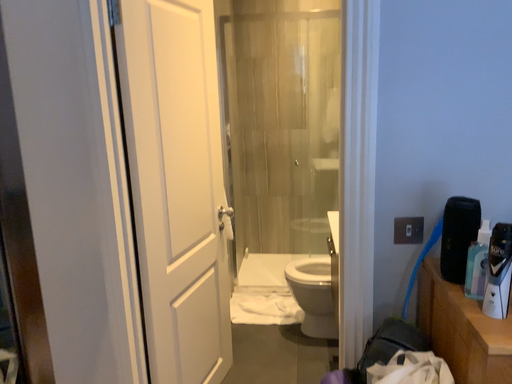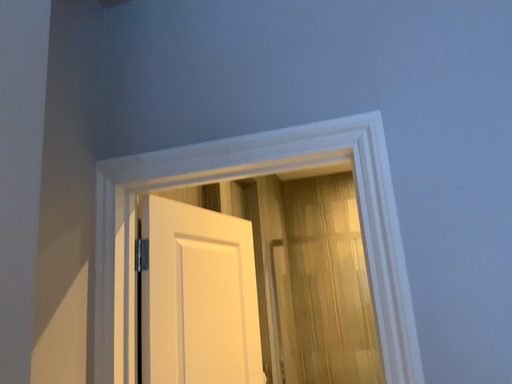
Question: How did the camera likely rotate when shooting the video?

Choices:
 (A) rotated downward
 (B) rotated upward

Answer: (B)